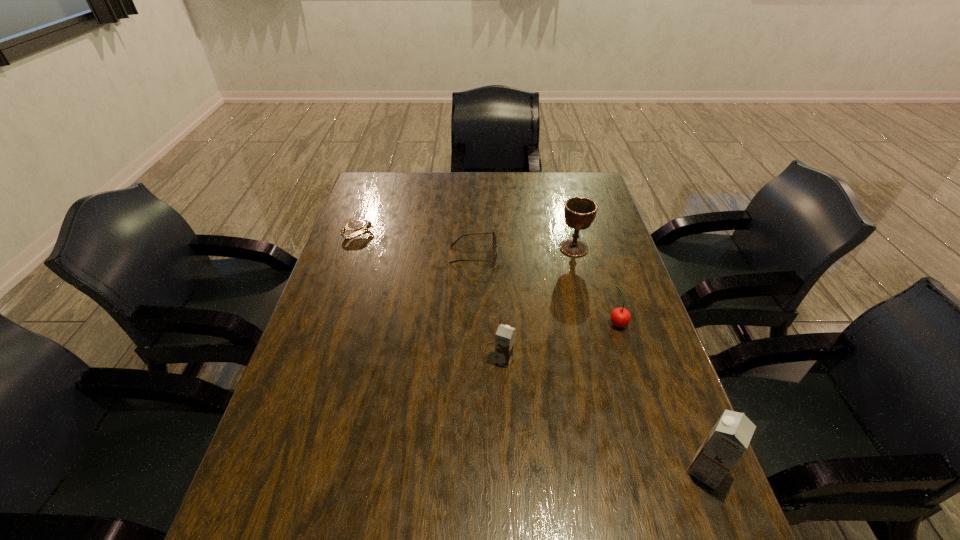
The height and width of the screenshot is (540, 960). Identify the location of object identified as the fourth closest to the sunglasses. (620, 317).

You are a GUI agent. You are given a task and a screenshot of the screen. Output one action in this format:
    pyautogui.click(x=<x>, y=<y>)
    Task: Click on the free spot that satisfies the following two spatial constraints: 1. on the front side of the shorter chocolate milk; 2. on the right side of the taller chocolate milk
    The height and width of the screenshot is (540, 960).
    Given the screenshot: What is the action you would take?
    pyautogui.click(x=510, y=470)

Where is `free region that satisfies the following two spatial constraints: 1. on the front-facing side of the fifth tallest object; 2. on the back side of the second nearest object`? The width and height of the screenshot is (960, 540). free region that satisfies the following two spatial constraints: 1. on the front-facing side of the fifth tallest object; 2. on the back side of the second nearest object is located at coordinates (472, 360).

Locate an element on the screen. free location that satisfies the following two spatial constraints: 1. on the front-facing side of the sunglasses; 2. on the right side of the fourth farthest object is located at coordinates (472, 323).